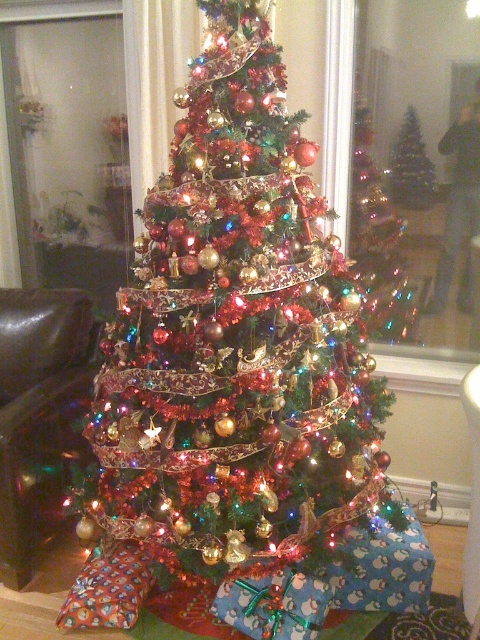
Is shiny metallic christmas tree at center below shiny metallic tree at center?

Yes.

Who is taller, shiny metallic christmas tree at center or shiny metallic tree at center?

shiny metallic christmas tree at center is taller.

This screenshot has width=480, height=640. Identify the location of shiny metallic christmas tree at center. (236, 339).

Does shiny metallic tree at center have a greater height compared to shiny silver christmas tree at center?

Yes.

Does shiny metallic tree at center appear over shiny silver christmas tree at center?

No, shiny metallic tree at center is not above shiny silver christmas tree at center.

Which is in front, point (363, 291) or point (396, 193)?

Point (363, 291) is more forward.

The width and height of the screenshot is (480, 640). Identify the location of shiny metallic tree at center. (377, 243).

Looking at this image, is shiny metallic christmas tree at center to the right of shiny silver christmas tree at center from the viewer's perspective?

In fact, shiny metallic christmas tree at center is to the left of shiny silver christmas tree at center.

Which is in front, point (291, 202) or point (433, 176)?

Point (291, 202) is in front.

I want to click on shiny metallic christmas tree at center, so click(x=236, y=339).